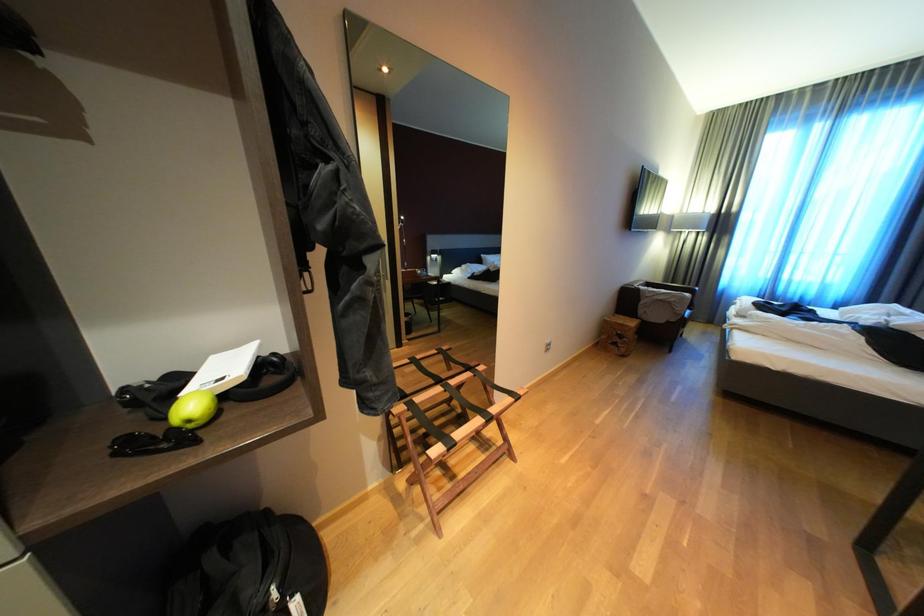
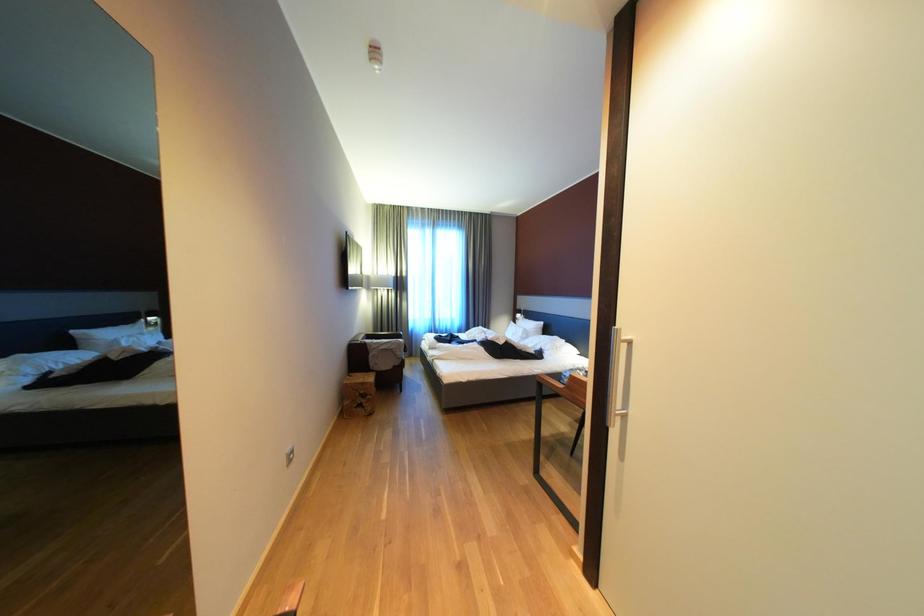
Question: The camera is either moving clockwise (left) or counter-clockwise (right) around the object. The first image is from the beginning of the video and the second image is from the end. Is the camera moving left or right when shooting the video?

Choices:
 (A) Left
 (B) Right

Answer: (A)